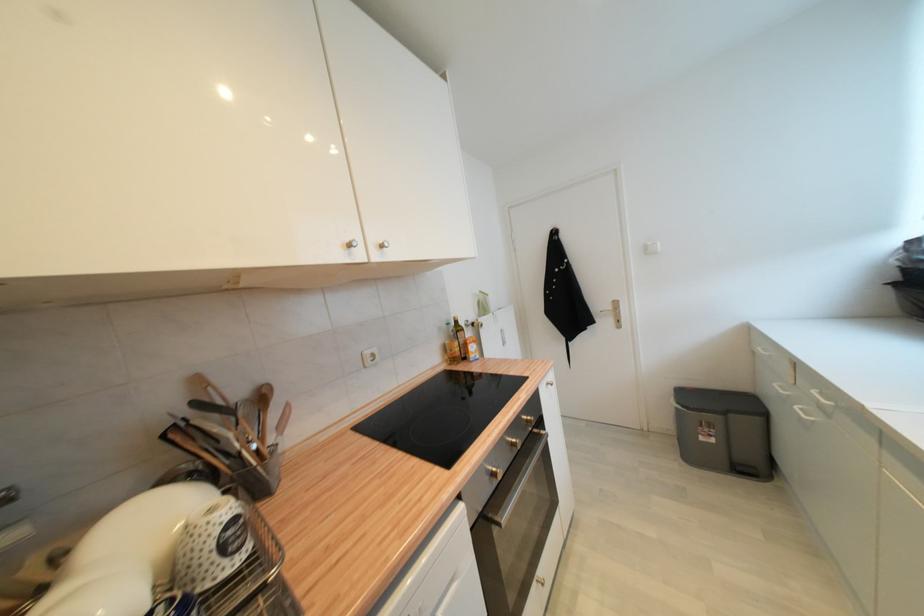
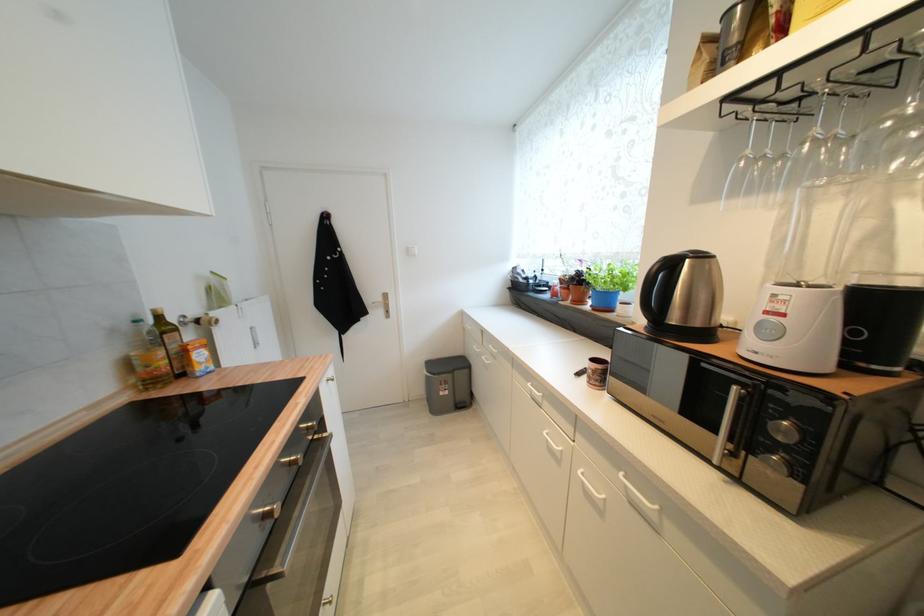
Question: The first image is from the beginning of the video and the second image is from the end. How did the camera likely rotate when shooting the video?

Choices:
 (A) Left
 (B) Right
 (C) Up
 (D) Down

Answer: (B)